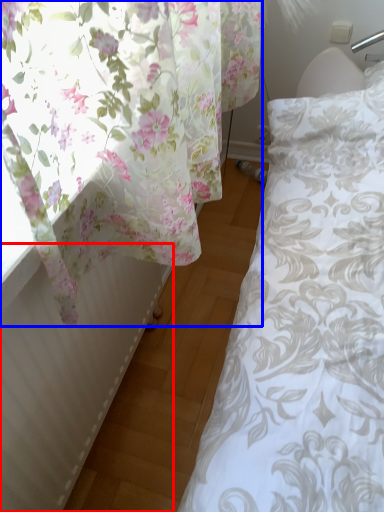
Question: Which point is further to the camera, radiator (highlighted by a red box) or curtain (highlighted by a blue box)?

Choices:
 (A) radiator
 (B) curtain

Answer: (B)